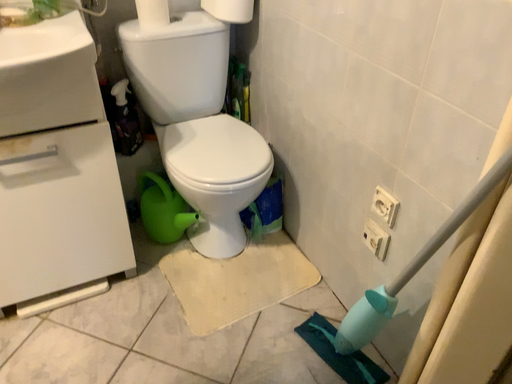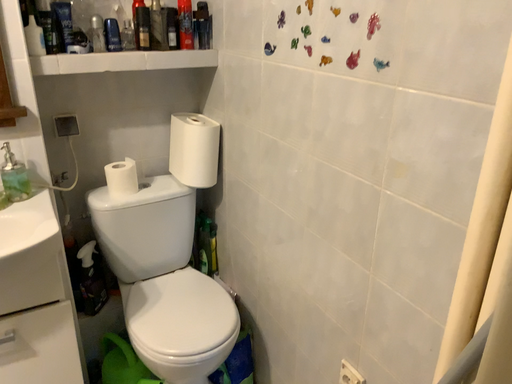
Question: How did the camera likely rotate when shooting the video?

Choices:
 (A) rotated upward
 (B) rotated downward

Answer: (A)